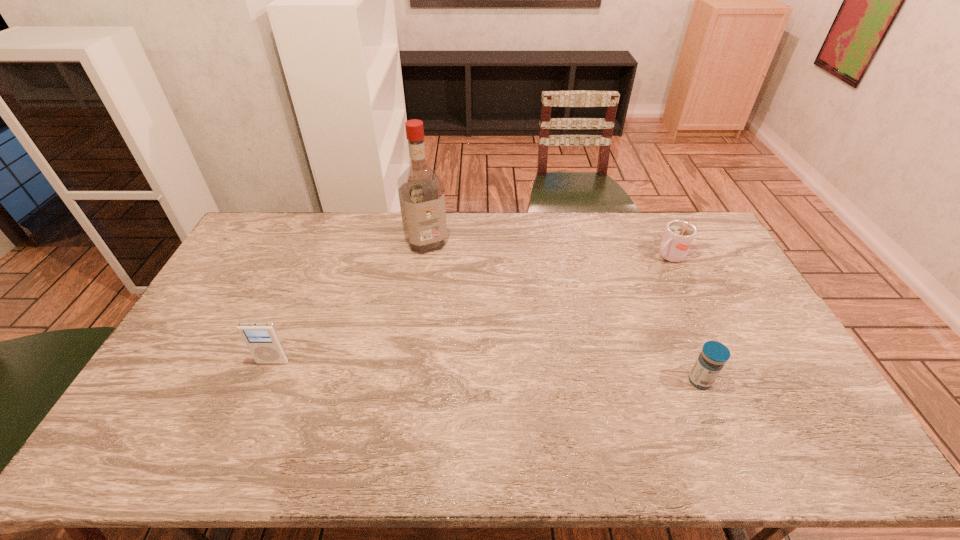
This screenshot has height=540, width=960. In order to click on empty space that is in between the leftmost object and the cup in this screenshot , I will do click(471, 309).

At what (x,y) coordinates should I click in order to perform the action: click on free spot between the liquor and the medicine. Please return your answer as a coordinate pair (x, y). This screenshot has height=540, width=960. Looking at the image, I should click on (563, 311).

Locate an element on the screen. The height and width of the screenshot is (540, 960). vacant region between the tallest object and the medicine is located at coordinates (563, 311).

I want to click on unoccupied area between the second nearest object and the cup, so click(x=471, y=309).

The height and width of the screenshot is (540, 960). Identify the location of free point between the leftmost object and the cup. (471, 309).

Locate an element on the screen. The height and width of the screenshot is (540, 960). free spot between the cup and the tallest object is located at coordinates (547, 249).

Select which object is the third closest to the shortest object. Please provide its 2D coordinates. Your answer should be formatted as a tuple, i.e. [(x, y)], where the tuple contains the x and y coordinates of a point satisfying the conditions above.

[(262, 339)]

The image size is (960, 540). I want to click on object that is the second nearest to the tallest object, so click(x=678, y=237).

Identify the location of vacant area that satisfies the following two spatial constraints: 1. on the front-facing side of the shortest object; 2. on the right side of the third farthest object. This screenshot has height=540, width=960. (265, 381).

At what (x,y) coordinates should I click in order to perform the action: click on free space that satisfies the following two spatial constraints: 1. on the front-facing side of the nearest object; 2. on the right side of the iPod. Please return your answer as a coordinate pair (x, y). Image resolution: width=960 pixels, height=540 pixels. Looking at the image, I should click on (265, 381).